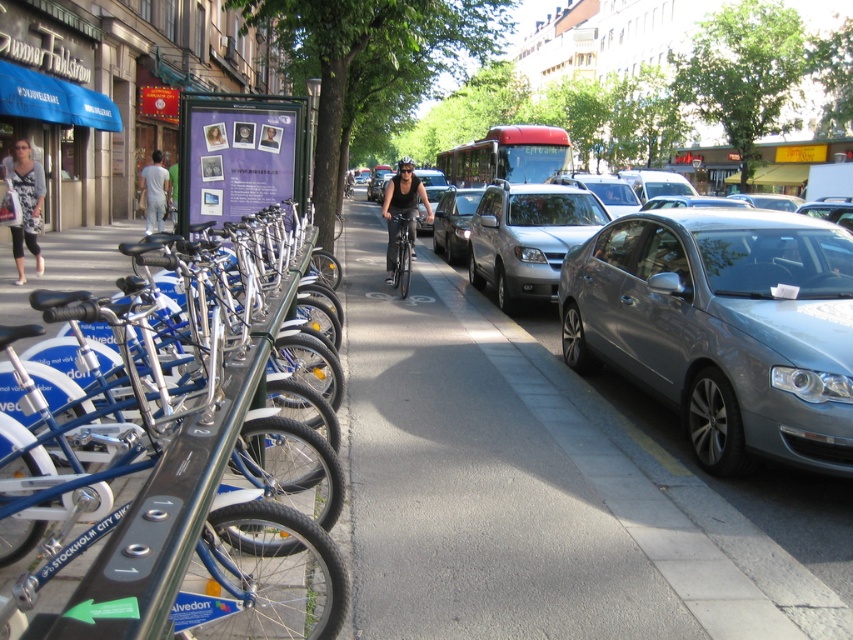
You are a delivery person who needs to park a 2.5 meter long silver metallic sedan at center in this area. Based on the scene, is there enough space to park the car without blocking the bike rack or the sidewalk?

The silver metallic sedan at center is located at coordinates (527, 237). Since the sedan is 2.5 meters long, there should be sufficient space to park it without obstructing the bike rack or the sidewalk, provided the parking area is appropriately sized.

You are a pedestrian standing on the sidewalk next to the bicycles. You want to cross the street to reach a store on the other side. Which sedan, the satin silver sedan at right or the shiny silver sedan at center, is closer to you?

The shiny silver sedan at center is closer to you because it is positioned to the left of the satin silver sedan at right, which is further away.

Consider the image. You are a delivery person who needs to load a tall package onto a car. You see two cars, the silver metallic sedan at center and the shiny silver sedan at center. Which car should you choose to load the tall package?

You should choose the silver metallic sedan at center because it is taller than the shiny silver sedan at center, providing more vertical space for the tall package.